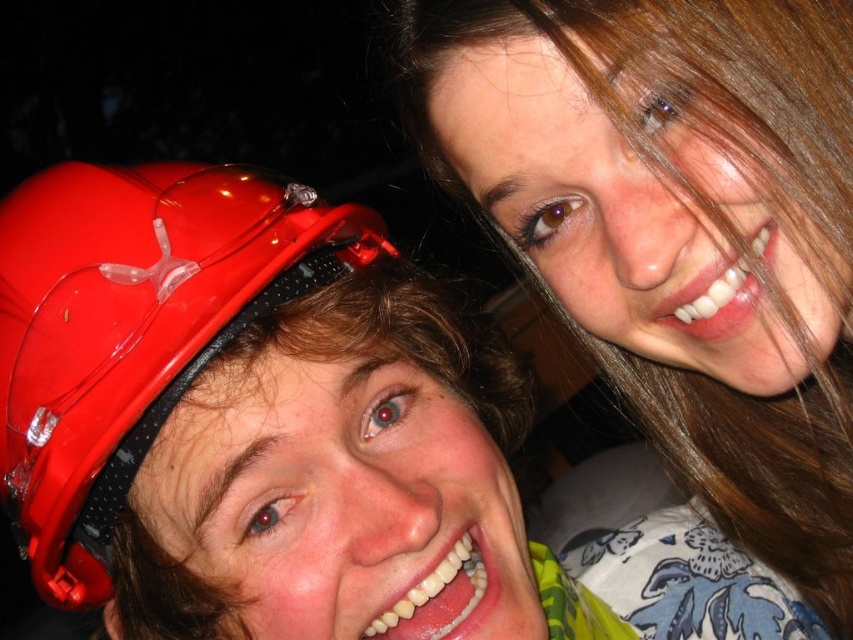
Who is positioned more to the left, shiny brown hair at upper right or matte plastic helmet at left?

Positioned to the left is matte plastic helmet at left.

Does shiny brown hair at upper right have a greater width compared to matte plastic helmet at left?

Yes.

Is point (602, 348) less distant than point (287, 285)?

No, (602, 348) is behind (287, 285).

Locate an element on the screen. shiny brown hair at upper right is located at coordinates (677, 228).